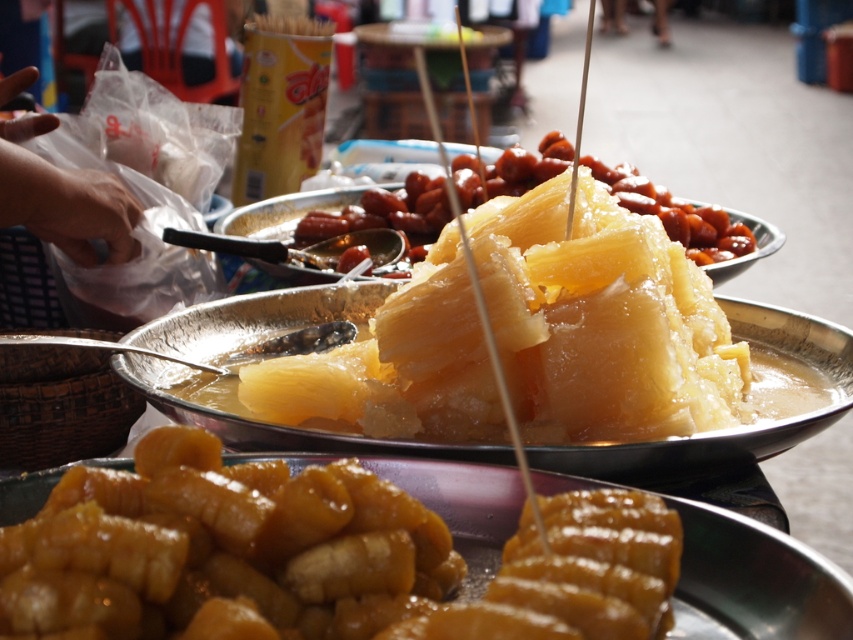
Who is more forward, [338,488] or [351,176]?

Positioned in front is point [338,488].

The width and height of the screenshot is (853, 640). Describe the element at coordinates (245, 536) in the screenshot. I see `golden brown dough at center` at that location.

The width and height of the screenshot is (853, 640). Identify the location of golden brown dough at center. (245, 536).

The width and height of the screenshot is (853, 640). I want to click on golden brown dough at center, so click(245, 536).

Is translucent sugar-coated pineapple at center thinner than smooth plastic bag at left?

In fact, translucent sugar-coated pineapple at center might be wider than smooth plastic bag at left.

Is translucent sugar-coated pineapple at center positioned at the back of smooth plastic bag at left?

Yes, translucent sugar-coated pineapple at center is further from the viewer.

Consider the image. Who is more distant from viewer, (717, 246) or (3, 102)?

The point (717, 246) is behind.

I want to click on translucent sugar-coated pineapple at center, so click(674, 212).

Between point (694, 424) and point (421, 248), which one is positioned behind?

Point (421, 248)

Consider the image. Can you confirm if translucent yellow gelatinous at center is bigger than translucent sugar-coated pineapple at center?

No.

Is point (503, 307) positioned after point (749, 246)?

No, it is in front of (749, 246).

I want to click on translucent yellow gelatinous at center, so click(601, 321).